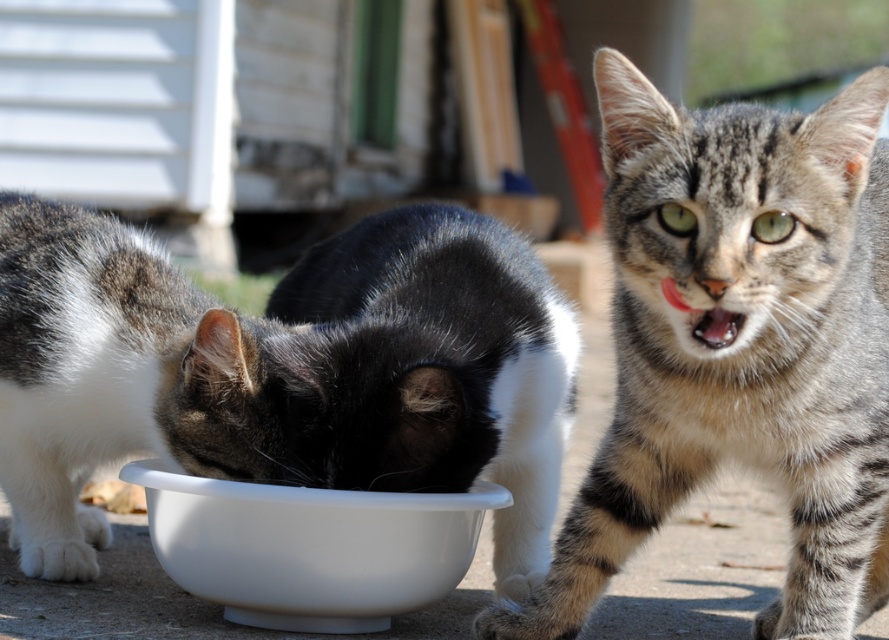
Question: Which of the following is the closest to the observer?

Choices:
 (A) white glossy bowl at center
 (B) tabby fur cat at center

Answer: (B)

Question: Is tabby fur cat at center above white glossy bowl at center?

Choices:
 (A) no
 (B) yes

Answer: (B)

Question: Is gray tabby cat at center positioned in front of white glossy bowl at center?

Choices:
 (A) no
 (B) yes

Answer: (B)

Question: Is gray tabby cat at center closer to the viewer compared to tabby fur cat at center?

Choices:
 (A) no
 (B) yes

Answer: (A)

Question: Which object appears closest to the camera in this image?

Choices:
 (A) white glossy bowl at center
 (B) tabby fur cat at center

Answer: (B)

Question: Which is farther from the tabby fur cat at center?

Choices:
 (A) white glossy bowl at center
 (B) gray tabby cat at center

Answer: (B)